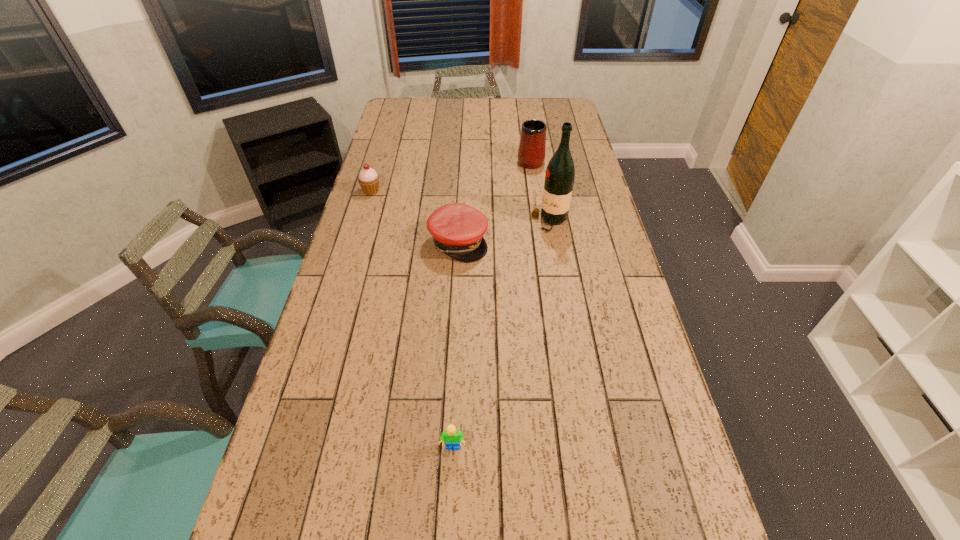
The width and height of the screenshot is (960, 540). In order to click on free point between the third shortest object and the Lego in this screenshot , I will do `click(412, 319)`.

Choose which object is the third nearest neighbor to the nearest object. Please provide its 2D coordinates. Your answer should be formatted as a tuple, i.e. [(x, y)], where the tuple contains the x and y coordinates of a point satisfying the conditions above.

[(368, 179)]

You are a GUI agent. You are given a task and a screenshot of the screen. Output one action in this format:
    pyautogui.click(x=<x>, y=<y>)
    Task: Click on the closest object to the leftmost object
    This screenshot has height=540, width=960.
    Given the screenshot: What is the action you would take?
    pyautogui.click(x=457, y=229)